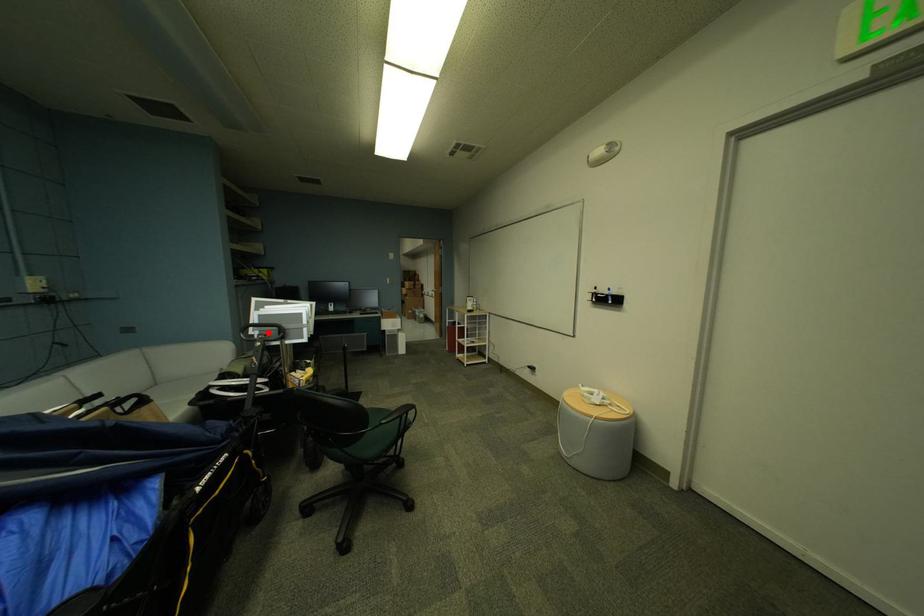
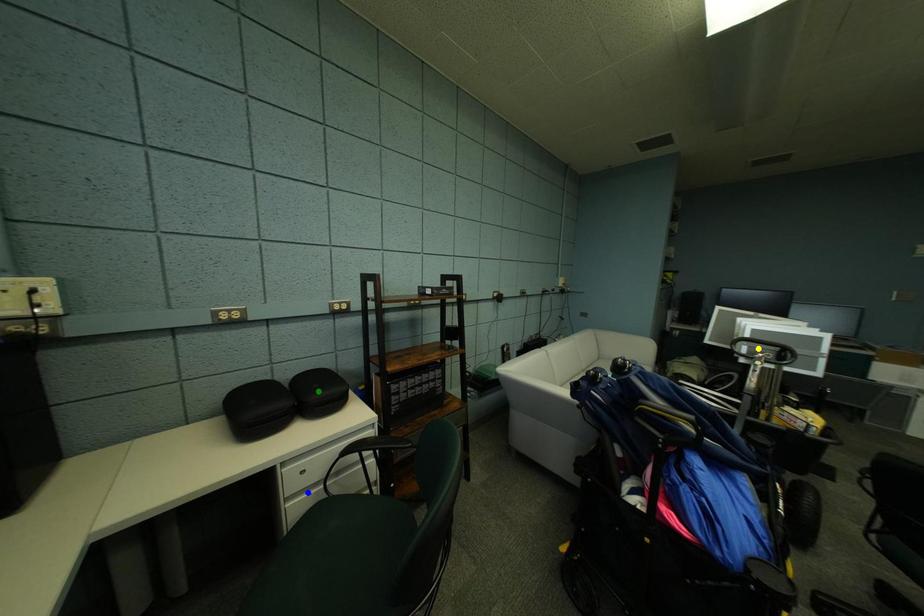
Question: I am providing you with two images of the same scene from different viewpoints. A red point is marked on the first image. You are given multiple points on the second image. Which spot in image 2 lines up with the point in image 1?

Choices:
 (A) green point
 (B) blue point
 (C) yellow point

Answer: (C)